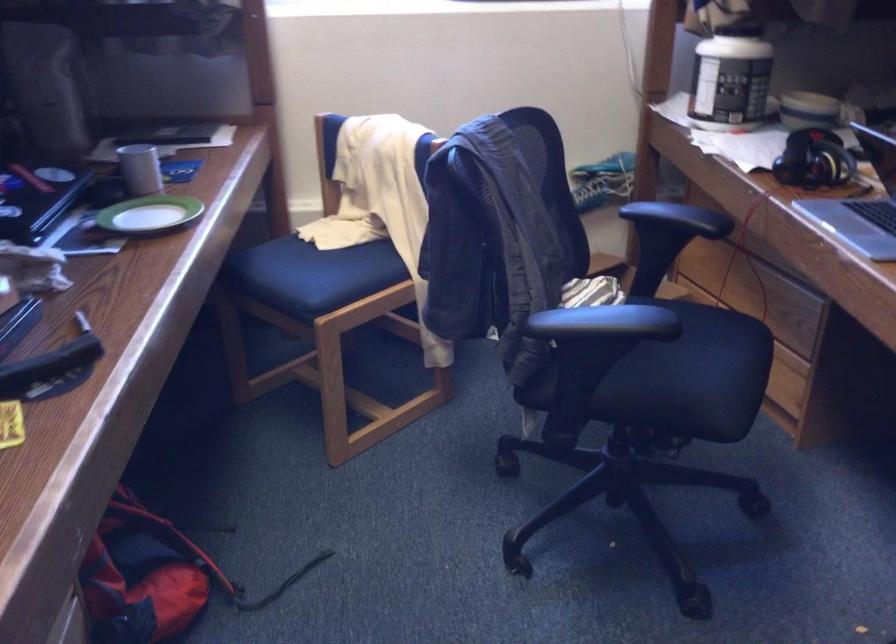
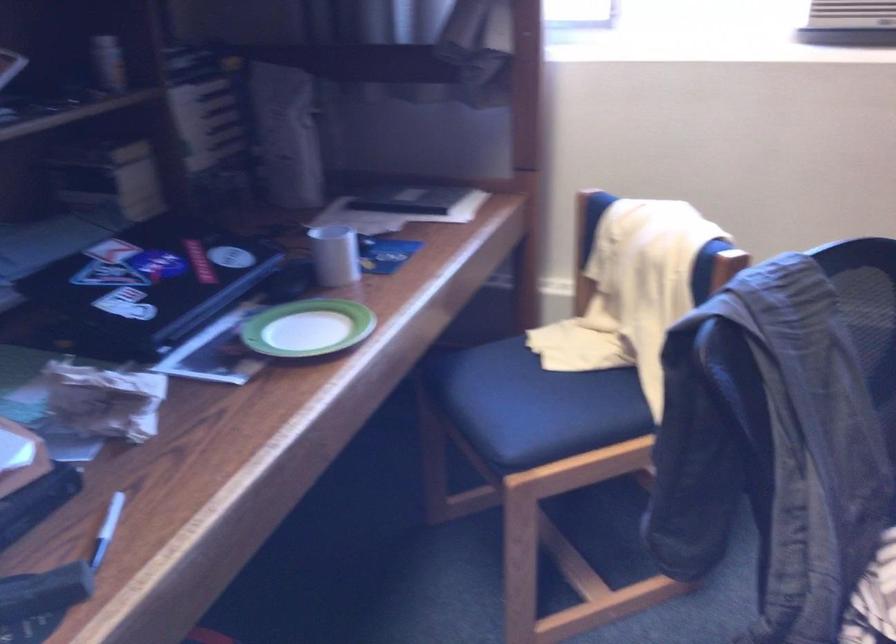
Find the pixel in the second image that matches [82,328] in the first image.

(107, 529)